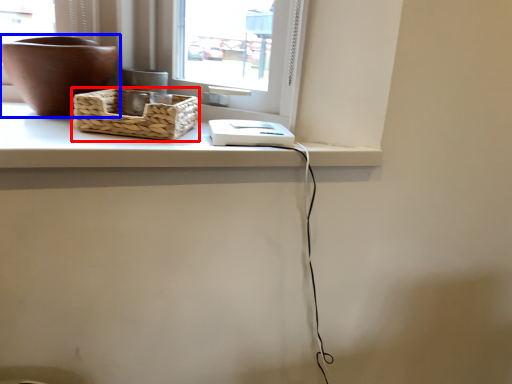
Question: Among these objects, which one is farthest to the camera, picnic basket (highlighted by a red box) or flowerpot (highlighted by a blue box)?

Choices:
 (A) picnic basket
 (B) flowerpot

Answer: (B)